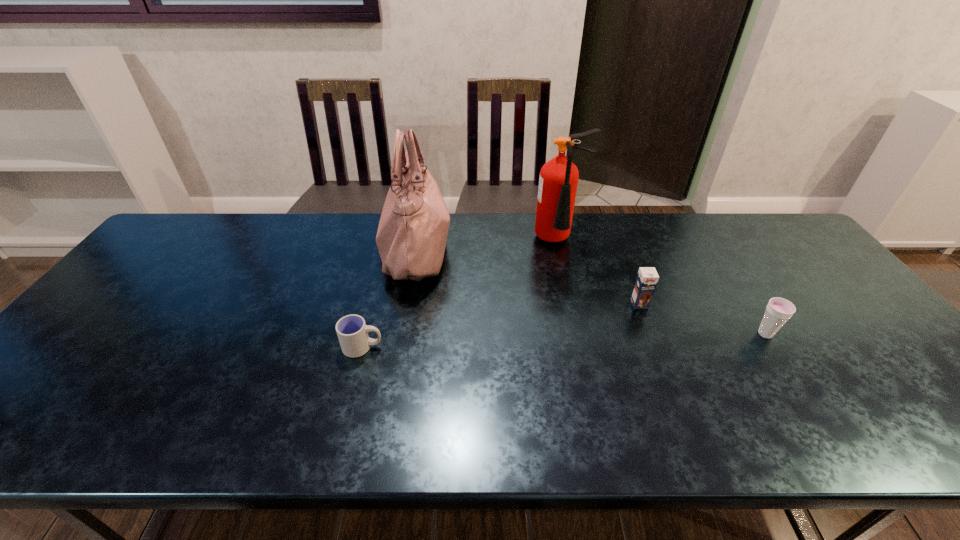
Choose which object is the third nearest neighbor to the chocolate milk. Please provide its 2D coordinates. Your answer should be formatted as a tuple, i.e. [(x, y)], where the tuple contains the x and y coordinates of a point satisfying the conditions above.

[(411, 238)]

Where is `object that ranks as the fourth closest to the handbag`? The width and height of the screenshot is (960, 540). object that ranks as the fourth closest to the handbag is located at coordinates (778, 311).

The image size is (960, 540). In order to click on vacant space that satisfies the following two spatial constraints: 1. at the front of the taller cup with handles; 2. on the right side of the handbag in this screenshot , I will do 400,334.

You are a GUI agent. You are given a task and a screenshot of the screen. Output one action in this format:
    pyautogui.click(x=<x>, y=<y>)
    Task: Click on the free spot that satisfies the following two spatial constraints: 1. at the nozzle of the rightmost object; 2. on the right side of the fire extinguisher
    
    Given the screenshot: What is the action you would take?
    pyautogui.click(x=580, y=334)

Locate an element on the screen. free location that satisfies the following two spatial constraints: 1. at the nozzle of the fire extinguisher; 2. at the front of the handbag with handles is located at coordinates (561, 249).

Locate an element on the screen. The height and width of the screenshot is (540, 960). free space that satisfies the following two spatial constraints: 1. at the nozzle of the third object from right to left; 2. at the front of the handbag with handles is located at coordinates (561, 249).

I want to click on free space that satisfies the following two spatial constraints: 1. on the front label of the third farthest object; 2. with the handle on the side of the left cup, so click(x=657, y=347).

You are a GUI agent. You are given a task and a screenshot of the screen. Output one action in this format:
    pyautogui.click(x=<x>, y=<y>)
    Task: Click on the vacant space that satisfies the following two spatial constraints: 1. at the nozzle of the fire extinguisher; 2. with the handle on the side of the left cup
    The image size is (960, 540).
    Given the screenshot: What is the action you would take?
    pyautogui.click(x=583, y=347)